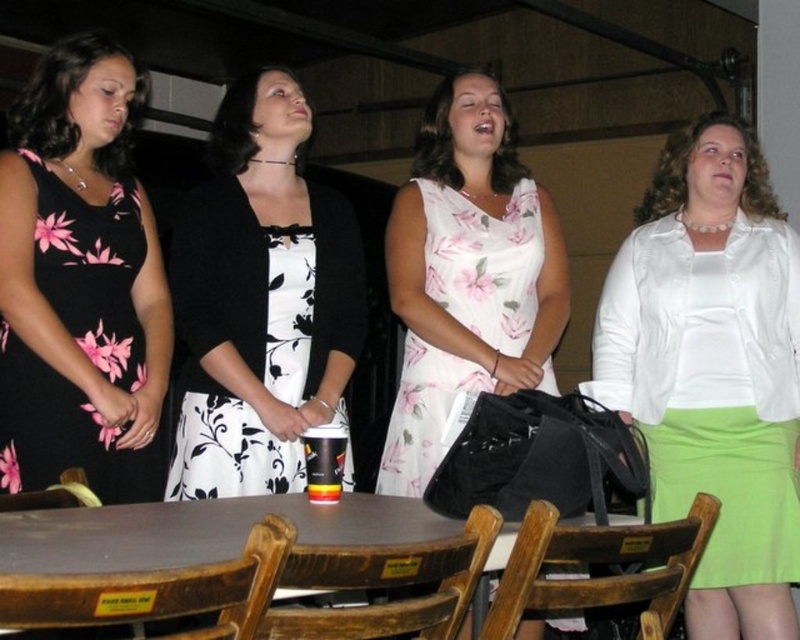
Question: Which point is farther to the camera?

Choices:
 (A) (424, 525)
 (B) (48, 208)
 (C) (442, 284)

Answer: (C)

Question: Which point is farther to the camera?

Choices:
 (A) white satin blouse at center
 (B) brown wooden table at center
 (C) black floral dress at center

Answer: (A)

Question: Is white satin blouse at center in front of black floral dress at left?

Choices:
 (A) yes
 (B) no

Answer: (B)

Question: Can you confirm if white satin blouse at center is positioned to the right of black floral dress at center?

Choices:
 (A) yes
 (B) no

Answer: (A)

Question: Where is black floral dress at left located in relation to white floral dress at center in the image?

Choices:
 (A) below
 (B) above

Answer: (A)

Question: Based on their relative distances, which object is farther from the black floral dress at left?

Choices:
 (A) brown wooden table at center
 (B) black floral dress at center

Answer: (A)